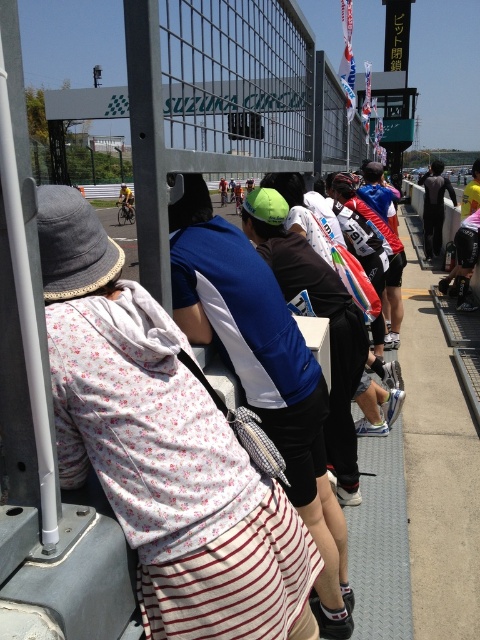
Based on the photo, between blue/white jersey at center and black matte wetsuit at center, which one has less height?

blue/white jersey at center

Is blue/white jersey at center positioned before black matte wetsuit at center?

Yes, blue/white jersey at center is in front of black matte wetsuit at center.

Based on the photo, who is more forward, (313,484) or (446,186)?

Positioned in front is point (313,484).

Locate an element on the screen. The image size is (480, 640). blue/white jersey at center is located at coordinates (263, 372).

Is floral fabric dress at center wider than black matte wetsuit at center?

Incorrect, floral fabric dress at center's width does not surpass black matte wetsuit at center's.

Is floral fabric dress at center to the right of black matte wetsuit at center from the viewer's perspective?

No, floral fabric dress at center is not to the right of black matte wetsuit at center.

Does point (190, 451) come closer to viewer compared to point (433, 189)?

Yes, it is in front of point (433, 189).

Find the location of a particular element. This screenshot has height=640, width=480. floral fabric dress at center is located at coordinates (163, 449).

Measure the distance between floral fabric dress at center and blue/white jersey at center.

floral fabric dress at center is 19.13 inches away from blue/white jersey at center.

Is floral fabric dress at center in front of blue/white jersey at center?

Yes, it is in front of blue/white jersey at center.

This screenshot has height=640, width=480. I want to click on floral fabric dress at center, so click(163, 449).